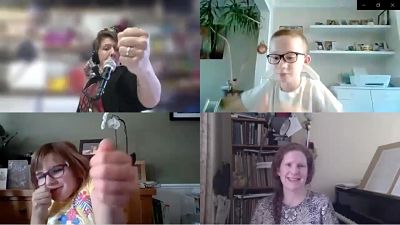
I want to click on plant, so click(246, 15).